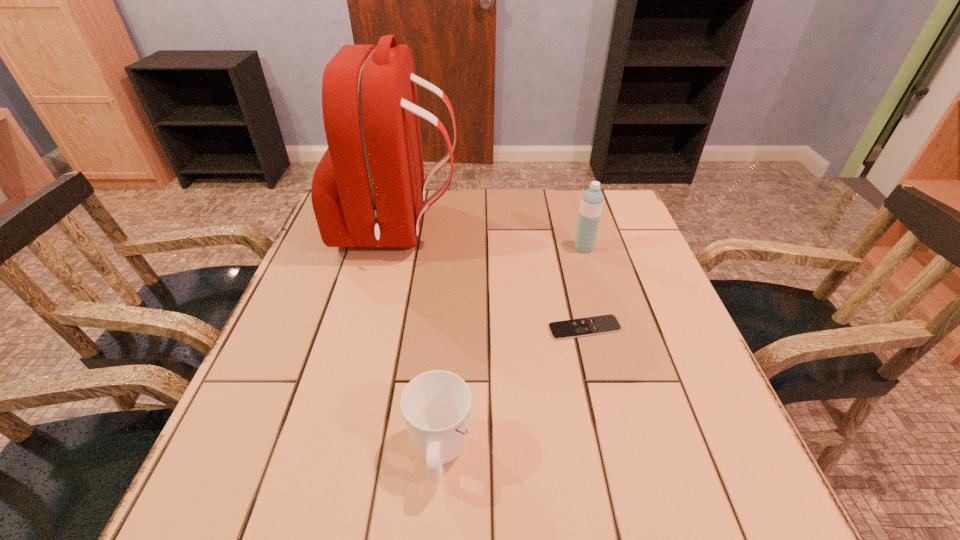
You are a GUI agent. You are given a task and a screenshot of the screen. Output one action in this format:
    pyautogui.click(x=<x>, y=<y>)
    Task: Click on the vacant space at the left edge
    This screenshot has height=540, width=960.
    Given the screenshot: What is the action you would take?
    pyautogui.click(x=328, y=316)

In the image, there is a desktop. In order to click on blank space at the right edge in this screenshot , I will do `click(691, 457)`.

What are the coordinates of `vacant space at the near left corner` in the screenshot? It's located at (219, 501).

The image size is (960, 540). In the image, there is a desktop. What are the coordinates of `vacant region at the far right corner` in the screenshot? It's located at (622, 205).

You are a GUI agent. You are given a task and a screenshot of the screen. Output one action in this format:
    pyautogui.click(x=<x>, y=<y>)
    Task: Click on the vacant space at the near right corner
    Image resolution: width=960 pixels, height=540 pixels.
    Given the screenshot: What is the action you would take?
    pyautogui.click(x=686, y=497)

At what (x,y) coordinates should I click in order to perform the action: click on vacant area between the third shortest object and the remote control. Please return your answer as a coordinate pair (x, y). Looking at the image, I should click on (584, 288).

In order to click on free spot between the remote control and the water bottle in this screenshot , I will do `click(584, 288)`.

Find the location of `vacant region between the shortest object and the second shortest object`. vacant region between the shortest object and the second shortest object is located at coordinates (512, 391).

I want to click on free space that is in between the tallest object and the second nearest object, so (x=492, y=279).

At what (x,y) coordinates should I click in order to perform the action: click on vacant area between the nearest object and the third shortest object. Please return your answer as a coordinate pair (x, y). Image resolution: width=960 pixels, height=540 pixels. Looking at the image, I should click on (512, 350).